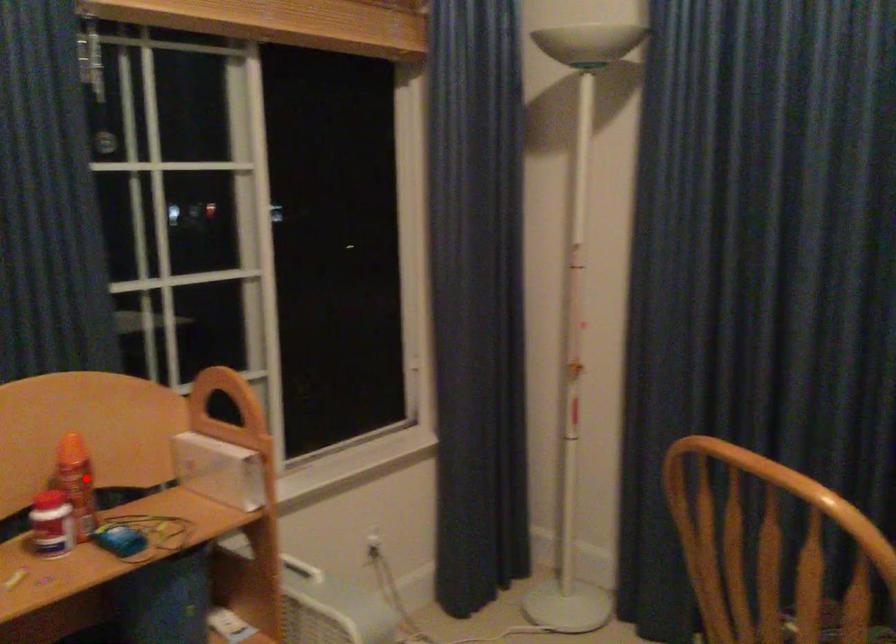
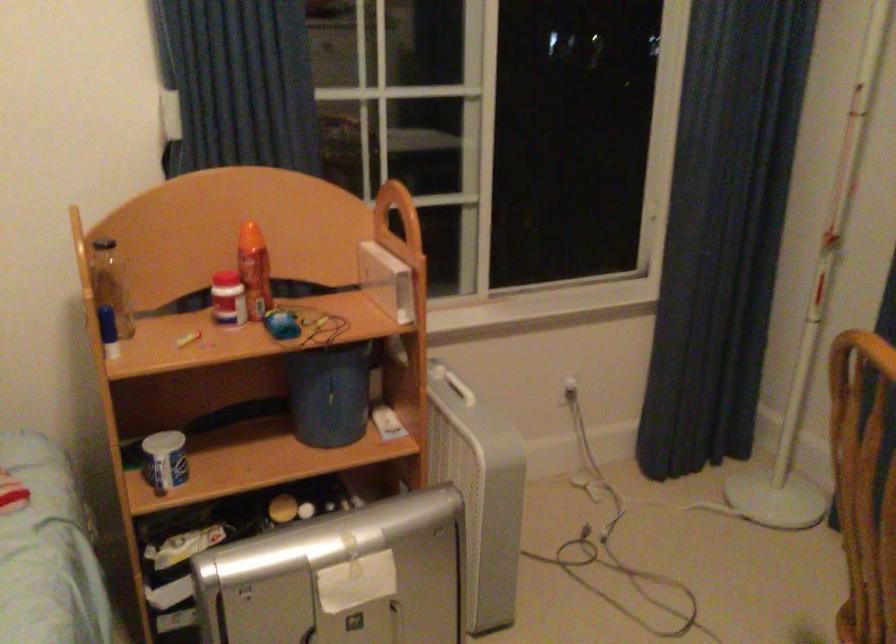
Find the pixel in the second image that matches the highlighted location in the first image.

(254, 270)